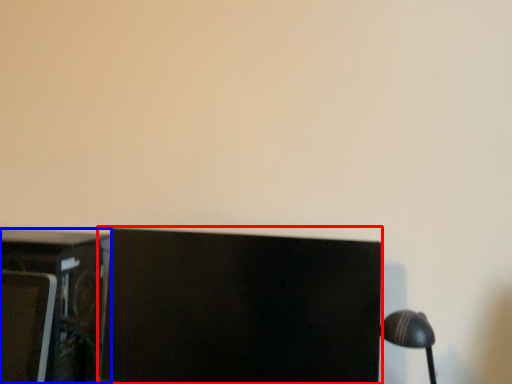
Question: Which of the following is the closest to the observer, computer monitor (highlighted by a red box) or furniture (highlighted by a blue box)?

Choices:
 (A) computer monitor
 (B) furniture

Answer: (A)